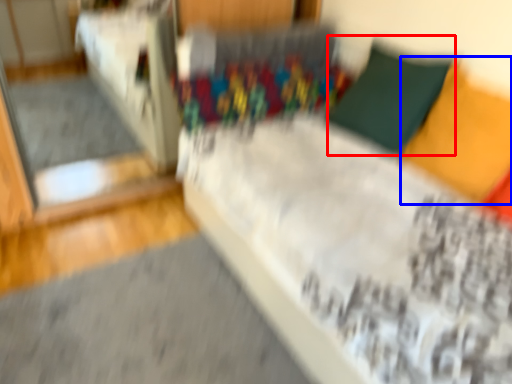
Question: Which of the following is the closest to the observer, pillow (highlighted by a red box) or pillow (highlighted by a blue box)?

Choices:
 (A) pillow
 (B) pillow

Answer: (B)